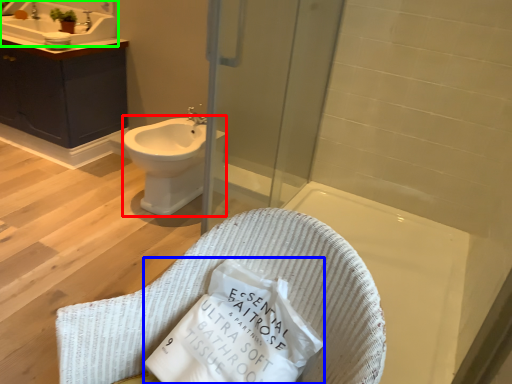
Question: Which object is the farthest from bidet (highlighted by a red box)? Choose among these: material (highlighted by a blue box) or sink (highlighted by a green box).

Choices:
 (A) material
 (B) sink

Answer: (A)